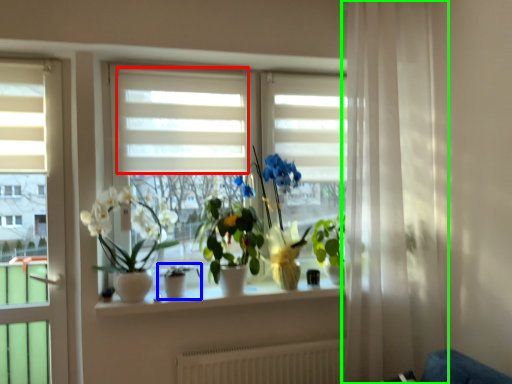
Question: Which object is positioned closest to blind (highlighted by a red box)? Select from houseplant (highlighted by a blue box) and curtain (highlighted by a green box).

Choices:
 (A) houseplant
 (B) curtain

Answer: (A)